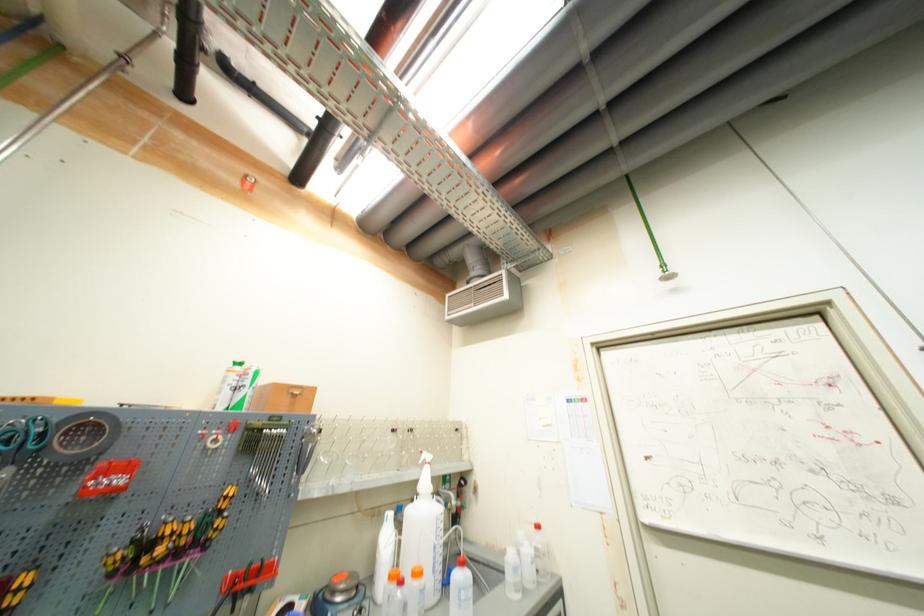
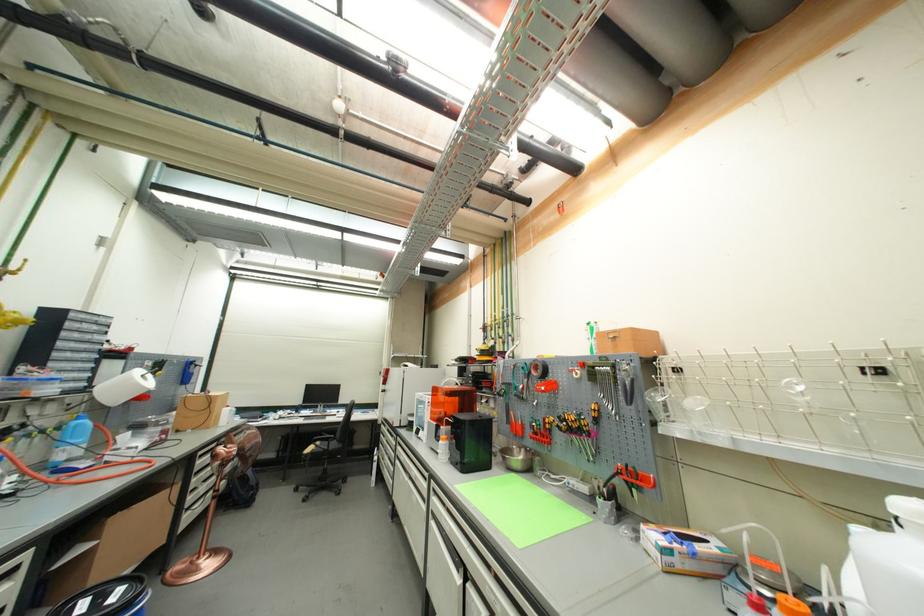
In the second image, find the point that corresponds to (390,456) in the first image.

(820, 413)